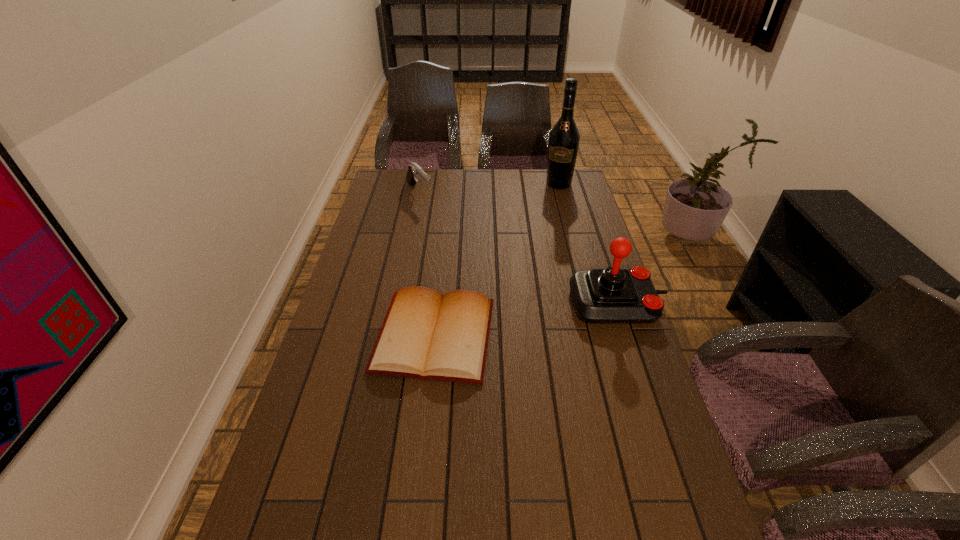
The image size is (960, 540). Find the location of `Bible`. Bible is located at coordinates (427, 335).

At what (x,y) coordinates should I click in order to perform the action: click on joystick. Please return your answer as a coordinate pair (x, y). This screenshot has height=540, width=960. Looking at the image, I should click on (612, 295).

Identify the location of wine bottle. (x=564, y=138).

The width and height of the screenshot is (960, 540). I want to click on the second shortest object, so click(x=415, y=171).

At what (x,y) coordinates should I click in order to perform the action: click on vacant space situated on the right of the shortest object. Please return your answer as a coordinate pair (x, y). This screenshot has width=960, height=540. Looking at the image, I should click on (540, 335).

This screenshot has width=960, height=540. Find the location of `free space located on the label of the tallest object`. free space located on the label of the tallest object is located at coordinates (541, 227).

Where is `vacant space situated 0.280m on the label of the tallest object`? This screenshot has width=960, height=540. vacant space situated 0.280m on the label of the tallest object is located at coordinates (541, 226).

Where is `vacant space located on the label of the tallest object`? The height and width of the screenshot is (540, 960). vacant space located on the label of the tallest object is located at coordinates (543, 222).

The image size is (960, 540). I want to click on vacant point located at the muzzle of the second shortest object, so click(457, 233).

This screenshot has width=960, height=540. I want to click on free space located 0.090m at the muzzle of the second shortest object, so pos(437,213).